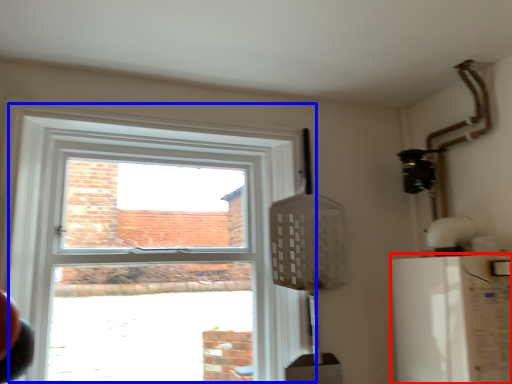
Question: Which point is further to the camera, appliance (highlighted by a red box) or window (highlighted by a blue box)?

Choices:
 (A) appliance
 (B) window

Answer: (B)